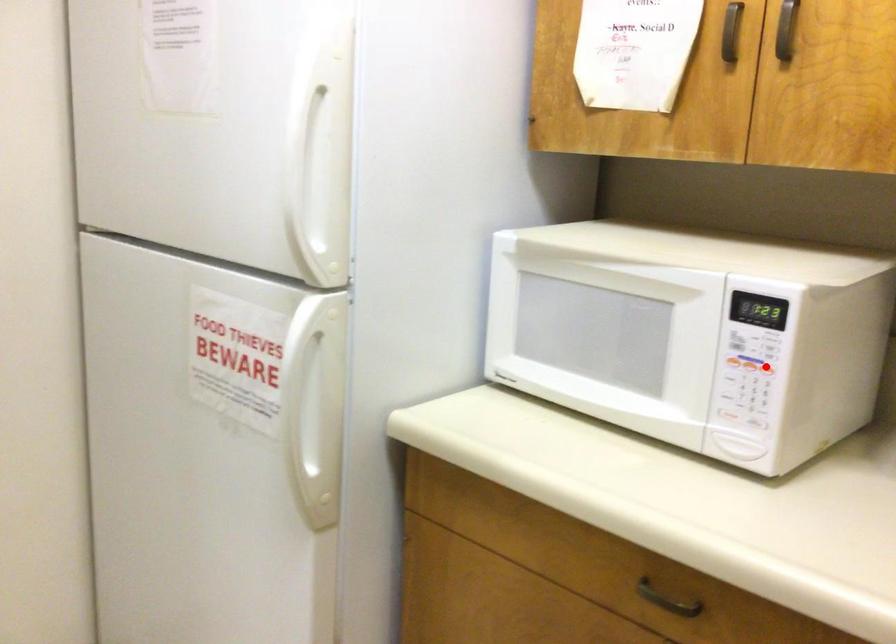
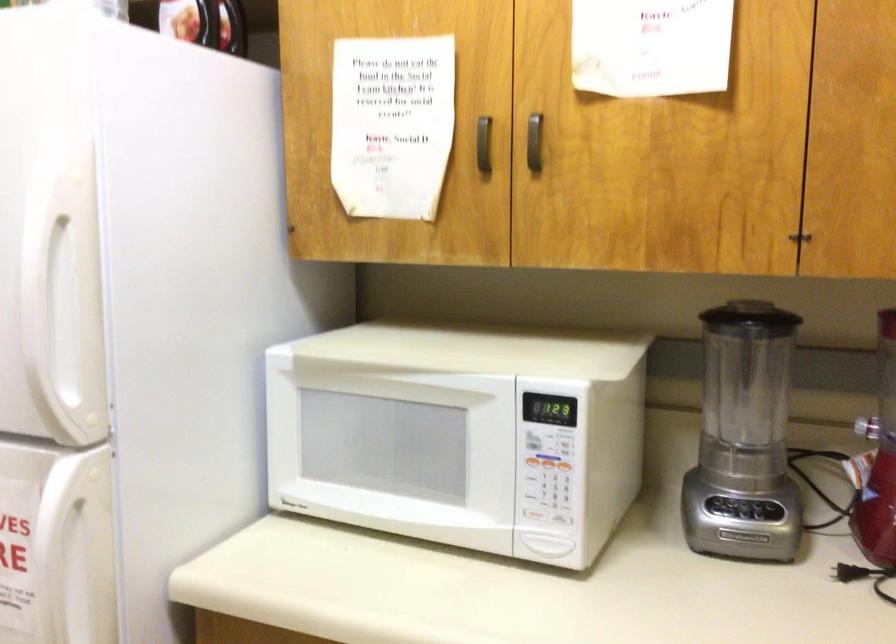
Locate, in the second image, the point that corresponds to the highlighted location in the first image.

(565, 467)